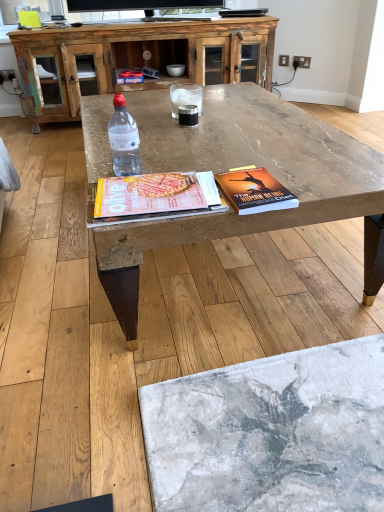
The image size is (384, 512). What are the coordinates of `vacant area that lies to the right of black rubberized cup at center` in the screenshot? It's located at (229, 122).